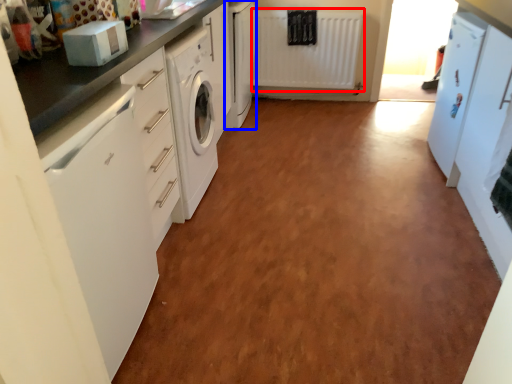
Question: Among these objects, which one is farthest to the camera, radiator (highlighted by a red box) or cabinetry (highlighted by a blue box)?

Choices:
 (A) radiator
 (B) cabinetry

Answer: (A)